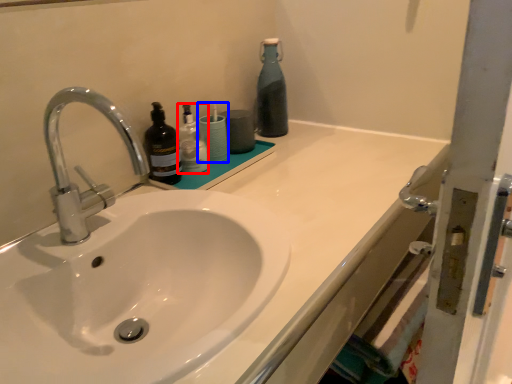
Question: Which of the following is the closest to the observer, bottle (highlighted by a red box) or toiletry (highlighted by a blue box)?

Choices:
 (A) bottle
 (B) toiletry

Answer: (A)